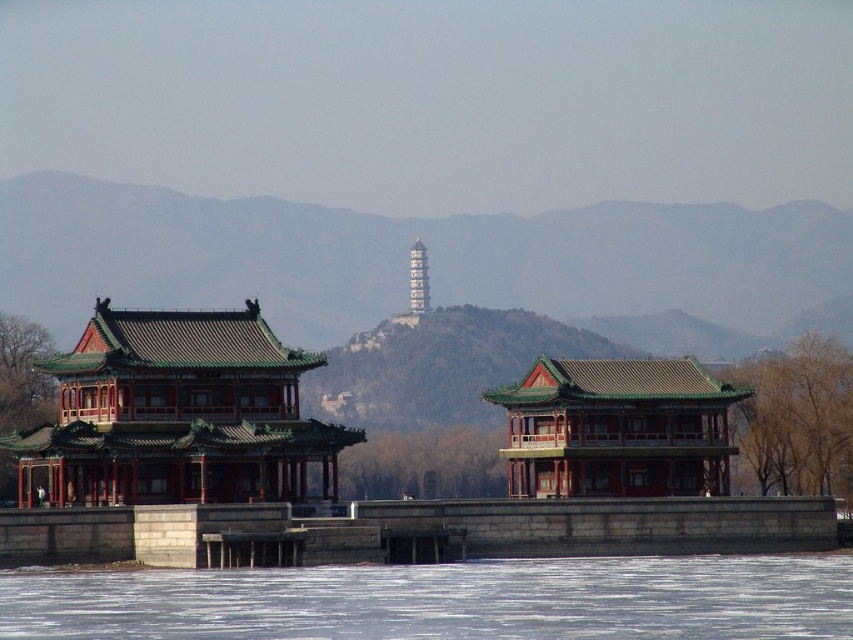
You are a tourist visiting the temple and tower. You want to take a photo that includes both the green glazed tile temple at center and the gold metallic tower at center. Which one should be placed to the right in your photo?

The green glazed tile temple at center is positioned on the right side of gold metallic tower at center, so in your photo, the green glazed tile temple at center should be placed to the right of the gold metallic tower at center.